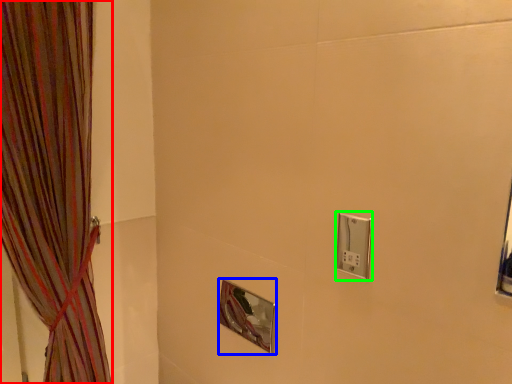
Question: Considering the real-world distances, which object is closest to curtain (highlighted by a red box)? mirror (highlighted by a blue box) or light switch (highlighted by a green box).

Choices:
 (A) mirror
 (B) light switch

Answer: (A)